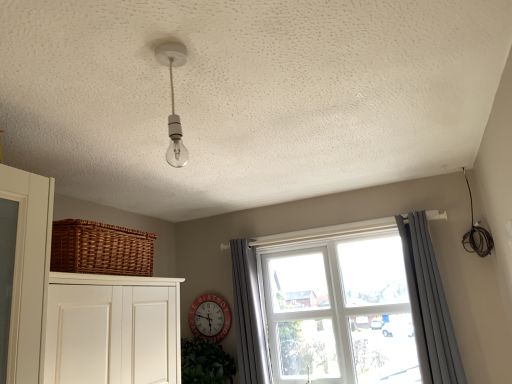
Question: From a real-world perspective, is clear glass window at center physically below gray fabric curtain at window, the first curtain from the left?

Choices:
 (A) yes
 (B) no

Answer: (A)

Question: From a real-world perspective, is clear glass window at center on top of gray fabric curtain at window, acting as the second curtain starting from the right?

Choices:
 (A) no
 (B) yes

Answer: (A)

Question: Is gray fabric curtain at window, the first curtain from the left, inside clear glass window at center?

Choices:
 (A) yes
 (B) no

Answer: (B)

Question: Can you confirm if clear glass window at center is thinner than gray fabric curtain at window, the first curtain from the left?

Choices:
 (A) no
 (B) yes

Answer: (A)

Question: Is clear glass window at center next to gray fabric curtain at window, acting as the second curtain starting from the right?

Choices:
 (A) yes
 (B) no

Answer: (B)

Question: From the image's perspective, is clear glass window at center on gray fabric curtain at window, the first curtain from the left?

Choices:
 (A) yes
 (B) no

Answer: (A)

Question: Is woven brown basket at left at the left side of gray fabric curtain at window, acting as the second curtain starting from the right?

Choices:
 (A) yes
 (B) no

Answer: (A)

Question: Is woven brown basket at left positioned before gray fabric curtain at window, the first curtain from the left?

Choices:
 (A) no
 (B) yes

Answer: (B)

Question: Is gray fabric curtain at window, the first curtain from the left, inside woven brown basket at left?

Choices:
 (A) no
 (B) yes

Answer: (A)

Question: Could you tell me if woven brown basket at left is turned towards gray fabric curtain at window, acting as the second curtain starting from the right?

Choices:
 (A) yes
 (B) no

Answer: (B)

Question: Does woven brown basket at left come behind gray fabric curtain at window, the first curtain from the left?

Choices:
 (A) no
 (B) yes

Answer: (A)

Question: From a real-world perspective, is woven brown basket at left positioned over gray fabric curtain at window, the first curtain from the left, based on gravity?

Choices:
 (A) yes
 (B) no

Answer: (A)

Question: Is gray fabric curtain at window, acting as the second curtain starting from the right, facing towards clear glass window at center?

Choices:
 (A) yes
 (B) no

Answer: (B)